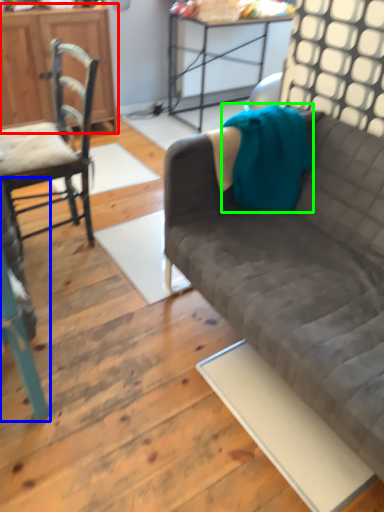
Question: Considering the real-world distances, which object is closest to cabinetry (highlighted by a red box)? chair (highlighted by a blue box) or blanket (highlighted by a green box).

Choices:
 (A) chair
 (B) blanket

Answer: (B)